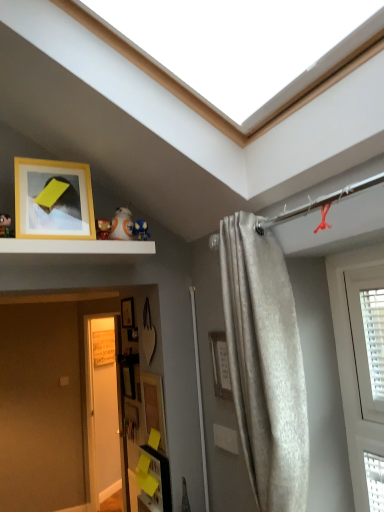
Question: Is wooden picture frame at center, which ranks as the 2th picture frame in top-to-bottom order, to the right of wooden picture frame at lower center, the 1th picture frame positioned from the bottom, from the viewer's perspective?

Choices:
 (A) yes
 (B) no

Answer: (B)

Question: Does wooden picture frame at center, placed as the fourth picture frame when sorted from front to back, have a larger size compared to wooden picture frame at lower center, the 1th picture frame positioned from the bottom?

Choices:
 (A) yes
 (B) no

Answer: (B)

Question: Can you confirm if wooden picture frame at center, which ranks as the 2th picture frame in top-to-bottom order, is smaller than wooden picture frame at lower center, the 1th picture frame positioned from the bottom?

Choices:
 (A) no
 (B) yes

Answer: (B)

Question: Would you say wooden picture frame at center, placed as the fourth picture frame when sorted from front to back, contains wooden picture frame at lower center, which is the 2th picture frame from back to front?

Choices:
 (A) no
 (B) yes

Answer: (A)

Question: From a real-world perspective, is wooden picture frame at center, the third picture frame from the bottom, below wooden picture frame at lower center, the third picture frame from the front?

Choices:
 (A) yes
 (B) no

Answer: (B)

Question: Considering the positions of wooden picture frame at center, the third picture frame from the bottom, and matte black toy at upper left, the fourth toy positioned from the right, in the image, is wooden picture frame at center, the third picture frame from the bottom, bigger or smaller than matte black toy at upper left, the fourth toy positioned from the right,?

Choices:
 (A) small
 (B) big

Answer: (B)

Question: Is wooden picture frame at center, which appears as the 1th picture frame when viewed from the back, in front of or behind matte black toy at upper left, marked as the fourth toy in a back-to-front arrangement, in the image?

Choices:
 (A) front
 (B) behind

Answer: (B)

Question: Would you say wooden picture frame at center, which ranks as the 2th picture frame in top-to-bottom order, is inside or outside matte black toy at upper left, the fourth toy positioned from the right?

Choices:
 (A) inside
 (B) outside

Answer: (B)

Question: From the image's perspective, is wooden picture frame at center, the third picture frame from the bottom, positioned above or below matte black toy at upper left, marked as the fourth toy in a back-to-front arrangement?

Choices:
 (A) above
 (B) below

Answer: (B)

Question: Does point (99, 237) appear closer or farther from the camera than point (109, 373)?

Choices:
 (A) closer
 (B) farther

Answer: (A)

Question: From a real-world perspective, is matte plastic toy at upper center, placed as the 3th toy when sorted from back to front, physically located above or below white glossy door at lower left?

Choices:
 (A) above
 (B) below

Answer: (A)

Question: Would you say matte plastic toy at upper center, which appears as the 2th toy when viewed from the left, is to the left or to the right of white glossy door at lower left in the picture?

Choices:
 (A) right
 (B) left

Answer: (A)

Question: Is matte plastic toy at upper center, which appears as the 2th toy when viewed from the left, spatially inside white glossy door at lower left, or outside of it?

Choices:
 (A) outside
 (B) inside

Answer: (A)

Question: Is white glossy bb8 droid at upper center, the 3th toy when ordered from front to back, wider or thinner than white matte shelf at upper center?

Choices:
 (A) thin
 (B) wide

Answer: (A)

Question: From a real-world perspective, is white glossy bb8 droid at upper center, the 2th toy viewed from the back, physically located above or below white matte shelf at upper center?

Choices:
 (A) above
 (B) below

Answer: (A)